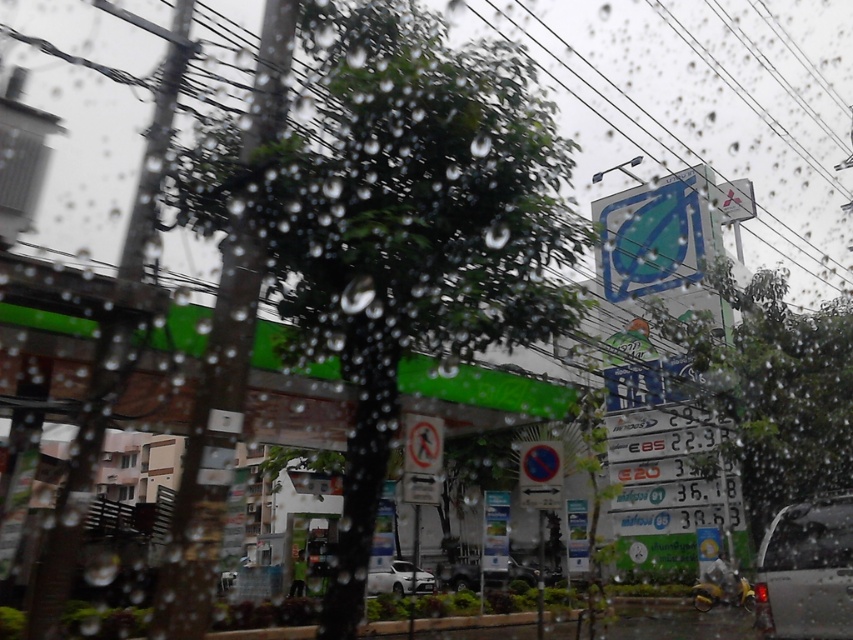
You are a delivery driver who needs to park your car in a tight space between two cars. You see a metallic silver suv at center and a white matte car at center. Which car should you avoid parking next to to ensure enough space?

You should avoid parking next to the metallic silver suv at center because it is larger in size than the white matte car at center, leaving less space between them.

You are standing at the point where the viewer is located in the image. A car is approaching the gas station from the road. If the car maintains a constant speed of 15 km per hour, how long will it take for the car to reach the point at point (459, 557)?

The distance between the viewer and point (459, 557) is 24.41 meters. To reach this point at 15 km per hour, the car will take approximately 5.9 seconds.

You are a delivery driver who needs to park your delivery van, which is 2 meters wide, in this parking lot. You see the metallic silver car at lower right and the metallic silver suv at center. Which vehicle can your van fit next to without overlapping?

The metallic silver suv at center is wider than the metallic silver car at lower right. Since your van is 2 meters wide, you can park next to the metallic silver suv at center because its width allows more space compared to the narrower metallic silver car at lower right.